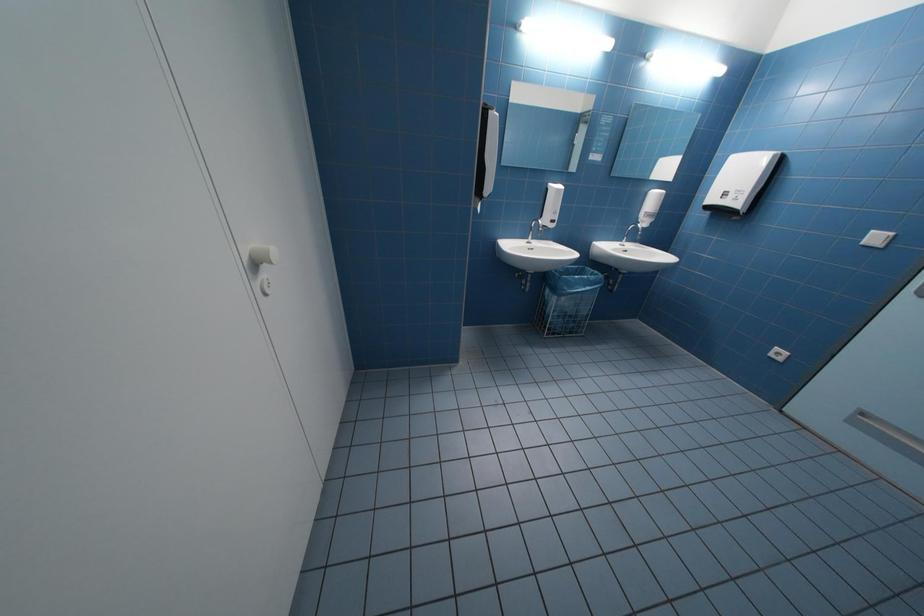
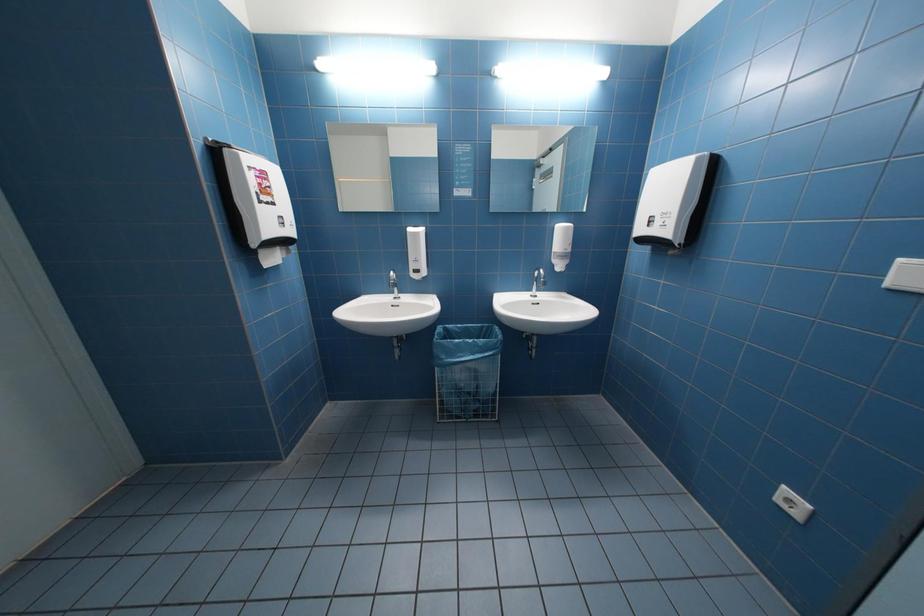
What movement of the cameraman would produce the second image?

The movement direction of the cameraman is right, forward.